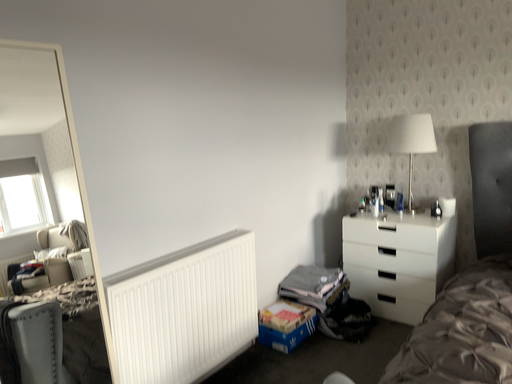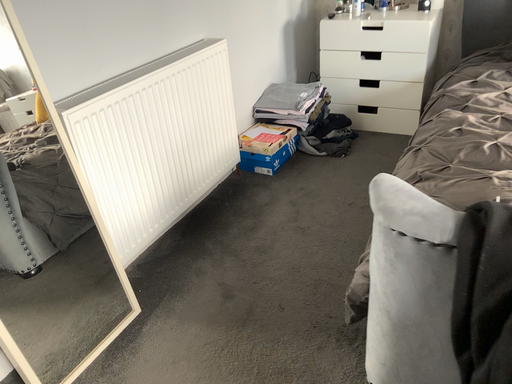
Question: How did the camera likely rotate when shooting the video?

Choices:
 (A) rotated left
 (B) rotated right

Answer: (B)